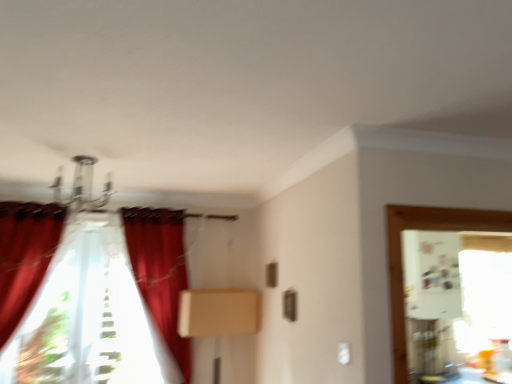
Question: Is the depth of velvet red curtain at center, the 1th curtain in the right-to-left sequence, less than that of velvet red curtain at left, arranged as the 3th curtain when viewed from the right?

Choices:
 (A) no
 (B) yes

Answer: (B)

Question: From a real-world perspective, is velvet red curtain at center, the 1th curtain in the right-to-left sequence, physically above velvet red curtain at left, arranged as the 3th curtain when viewed from the right?

Choices:
 (A) yes
 (B) no

Answer: (B)

Question: From the image's perspective, is velvet red curtain at center, which appears as the 3th curtain when viewed from the left, located above velvet red curtain at left, acting as the first curtain starting from the left?

Choices:
 (A) no
 (B) yes

Answer: (A)

Question: Can you confirm if velvet red curtain at center, the 1th curtain in the right-to-left sequence, is smaller than velvet red curtain at left, arranged as the 3th curtain when viewed from the right?

Choices:
 (A) yes
 (B) no

Answer: (B)

Question: Is velvet red curtain at center, which appears as the 3th curtain when viewed from the left, to the left of velvet red curtain at left, acting as the first curtain starting from the left, from the viewer's perspective?

Choices:
 (A) no
 (B) yes

Answer: (A)

Question: Is velvet red curtain at center, which appears as the 3th curtain when viewed from the left, taller or shorter than velvet red curtain at left, acting as the first curtain starting from the left?

Choices:
 (A) tall
 (B) short

Answer: (A)

Question: Relative to velvet red curtain at left, arranged as the 3th curtain when viewed from the right, is velvet red curtain at center, which appears as the 3th curtain when viewed from the left, in front or behind?

Choices:
 (A) front
 (B) behind

Answer: (A)

Question: Visually, is velvet red curtain at center, which appears as the 3th curtain when viewed from the left, positioned to the left or to the right of velvet red curtain at left, arranged as the 3th curtain when viewed from the right?

Choices:
 (A) right
 (B) left

Answer: (A)

Question: Considering the positions of velvet red curtain at center, which appears as the 3th curtain when viewed from the left, and velvet red curtain at left, arranged as the 3th curtain when viewed from the right, in the image, is velvet red curtain at center, which appears as the 3th curtain when viewed from the left, bigger or smaller than velvet red curtain at left, arranged as the 3th curtain when viewed from the right,?

Choices:
 (A) big
 (B) small

Answer: (A)

Question: From a real-world perspective, relative to translucent fabric curtain at left, positioned as the second curtain in right-to-left order, is velvet red curtain at center, the 1th curtain in the right-to-left sequence, vertically above or below?

Choices:
 (A) above
 (B) below

Answer: (A)

Question: In the image, is velvet red curtain at center, the 1th curtain in the right-to-left sequence, positioned in front of or behind translucent fabric curtain at left, the second curtain positioned from the left?

Choices:
 (A) behind
 (B) front

Answer: (B)

Question: Looking at the image, does velvet red curtain at center, the 1th curtain in the right-to-left sequence, seem bigger or smaller compared to translucent fabric curtain at left, positioned as the second curtain in right-to-left order?

Choices:
 (A) big
 (B) small

Answer: (A)

Question: From their relative heights in the image, would you say velvet red curtain at center, which appears as the 3th curtain when viewed from the left, is taller or shorter than translucent fabric curtain at left, the second curtain positioned from the left?

Choices:
 (A) short
 (B) tall

Answer: (B)

Question: Relative to beige cardboard box at center, is velvet red curtain at center, the 1th curtain in the right-to-left sequence, in front or behind?

Choices:
 (A) behind
 (B) front

Answer: (B)

Question: Visually, is velvet red curtain at center, the 1th curtain in the right-to-left sequence, positioned to the left or to the right of beige cardboard box at center?

Choices:
 (A) left
 (B) right

Answer: (A)